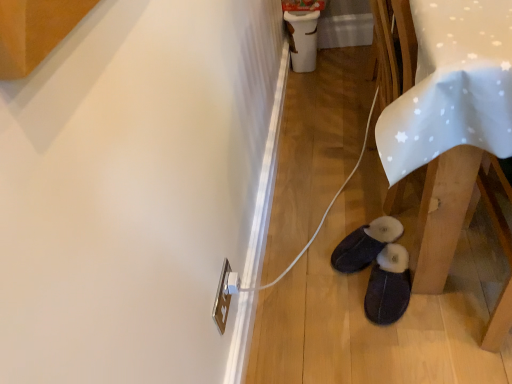
You are a GUI agent. You are given a task and a screenshot of the screen. Output one action in this format:
    pyautogui.click(x=<x>, y=<y>)
    Task: Click on the vacant space to the right of dark gray suede slippers at lower center, the 1th footwear when ordered from front to back
    
    Given the screenshot: What is the action you would take?
    pyautogui.click(x=460, y=284)